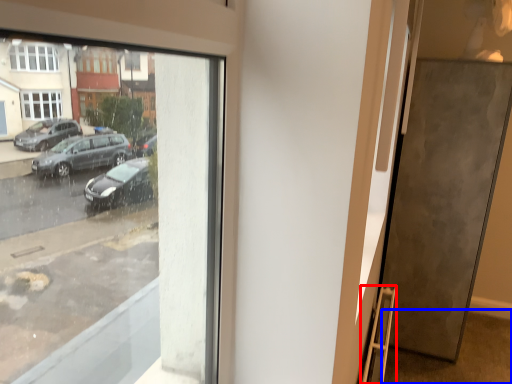
Question: Which of the following is the farthest to the observer, ladder (highlighted by a red box) or pavement (highlighted by a blue box)?

Choices:
 (A) ladder
 (B) pavement

Answer: (B)